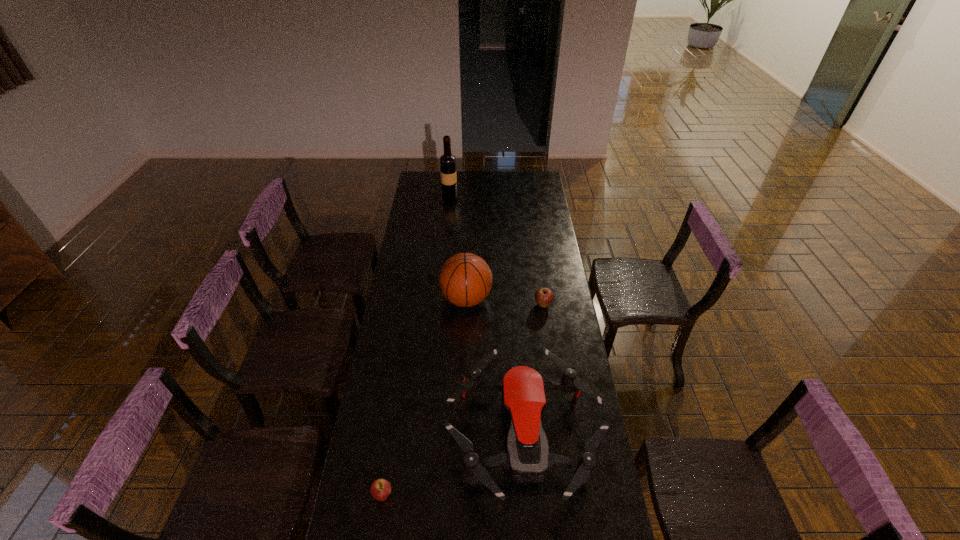
Where is `free space between the drone and the farthest object`? The width and height of the screenshot is (960, 540). free space between the drone and the farthest object is located at coordinates (487, 316).

Find the location of a particular element. The width and height of the screenshot is (960, 540). empty space that is in between the nearer apple and the drone is located at coordinates (453, 466).

The width and height of the screenshot is (960, 540). In order to click on vacant region between the tallest object and the basketball in this screenshot , I will do `click(458, 247)`.

You are a GUI agent. You are given a task and a screenshot of the screen. Output one action in this format:
    pyautogui.click(x=<x>, y=<y>)
    Task: Click on the free point between the tallest object and the right apple
    The height and width of the screenshot is (540, 960).
    Given the screenshot: What is the action you would take?
    pyautogui.click(x=496, y=250)

This screenshot has width=960, height=540. In order to click on vacant area that lies between the tallest object and the left apple in this screenshot , I will do `click(417, 346)`.

Find the location of `unoccupied area between the right apple and the wine bottle`. unoccupied area between the right apple and the wine bottle is located at coordinates (496, 250).

Select which object is the closest to the basketball. Please provide its 2D coordinates. Your answer should be formatted as a tuple, i.e. [(x, y)], where the tuple contains the x and y coordinates of a point satisfying the conditions above.

[(544, 296)]

Locate which object ranks second in proximity to the farthest object. Please provide its 2D coordinates. Your answer should be formatted as a tuple, i.e. [(x, y)], where the tuple contains the x and y coordinates of a point satisfying the conditions above.

[(544, 296)]

Find the location of `free spot that satisfies the following two spatial constraints: 1. on the front side of the right apple; 2. on the right side of the tallest object`. free spot that satisfies the following two spatial constraints: 1. on the front side of the right apple; 2. on the right side of the tallest object is located at coordinates (440, 305).

Where is `free space that satisfies the following two spatial constraints: 1. on the back side of the basketball; 2. on the left side of the leftmost object`? The image size is (960, 540). free space that satisfies the following two spatial constraints: 1. on the back side of the basketball; 2. on the left side of the leftmost object is located at coordinates (413, 299).